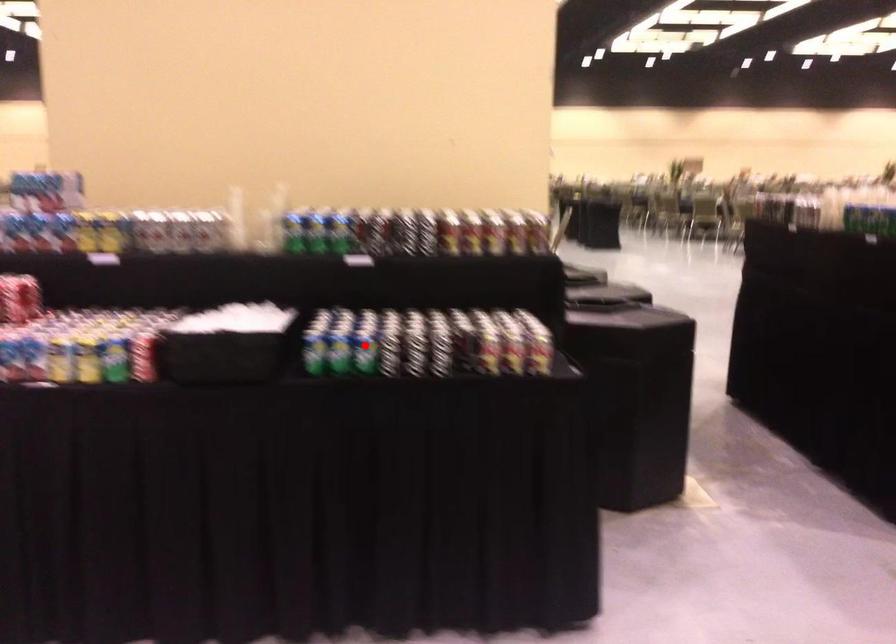
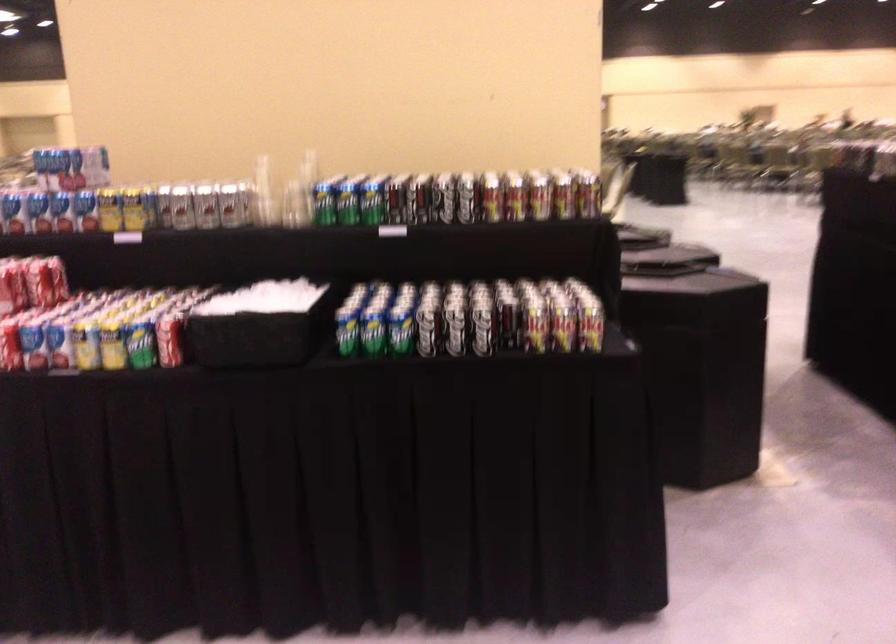
Where in the second image is the point corresponding to the highlighted location from the first image?

(401, 324)